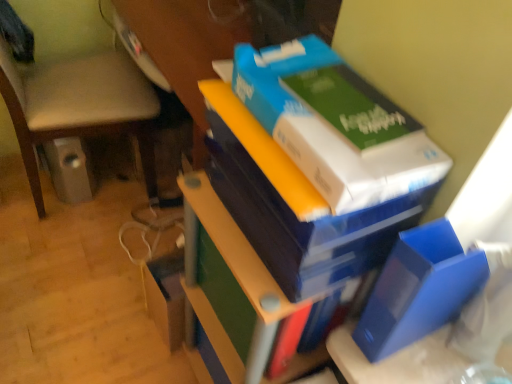
Question: Is green matte paperback book at upper right, which is counted as the first paperback book, starting from the top, to the left or to the right of blue cardboard box at upper right in the image?

Choices:
 (A) left
 (B) right

Answer: (B)

Question: Considering the positions of point (326, 76) and point (426, 178), is point (326, 76) closer or farther from the camera than point (426, 178)?

Choices:
 (A) closer
 (B) farther

Answer: (B)

Question: Which of these objects is positioned farthest from the blue cardboard box at upper right?

Choices:
 (A) white cardboard box at upper right
 (B) blue matte folder at lower right, which appears as the first paperback book when ordered from the bottom
 (C) beige fabric chair at lower left
 (D) green matte paperback book at upper right, placed as the 2th paperback book when sorted from bottom to top

Answer: (C)

Question: Which object is positioned closest to the white cardboard box at upper right?

Choices:
 (A) blue matte folder at lower right, the 2th paperback book viewed from the top
 (B) beige fabric chair at lower left
 (C) blue cardboard box at upper right
 (D) green matte paperback book at upper right, which is counted as the first paperback book, starting from the top

Answer: (D)